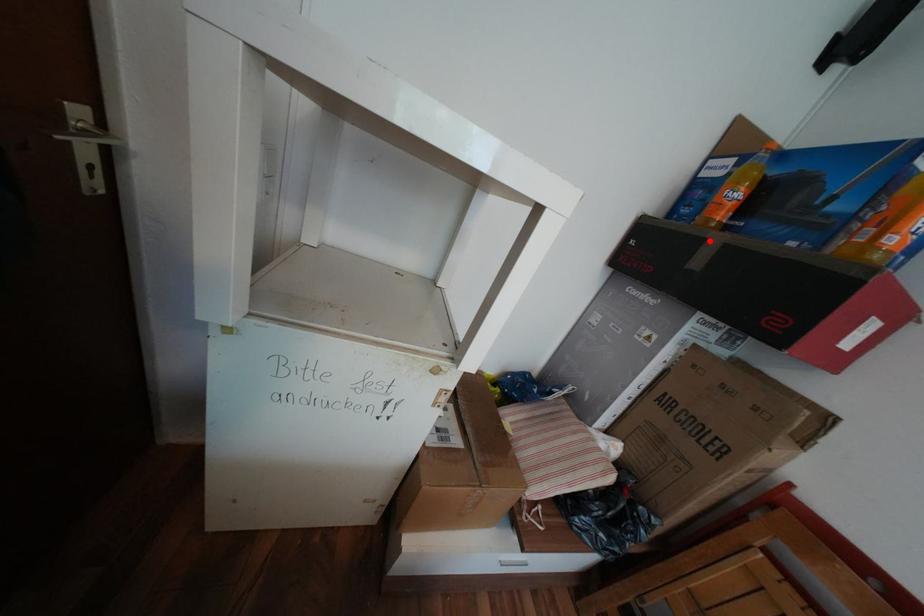
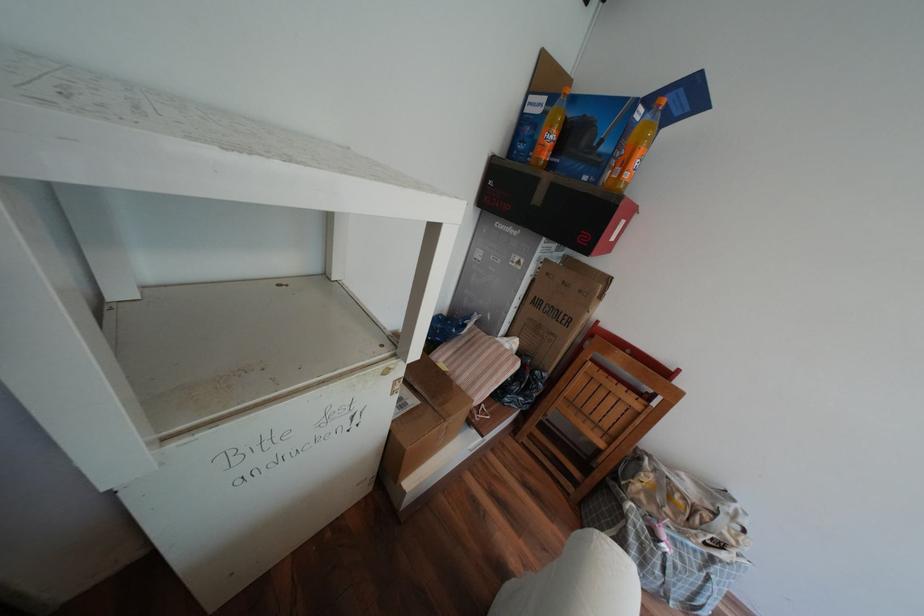
In the second image, find the point that corresponds to the highlighted location in the first image.

(545, 180)